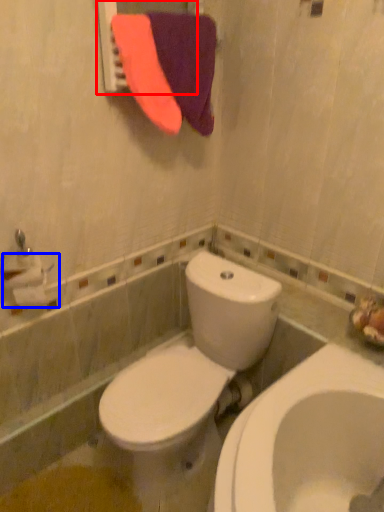
Question: Which of the following is the closest to the observer, mirror (highlighted by a red box) or toilet paper (highlighted by a blue box)?

Choices:
 (A) mirror
 (B) toilet paper

Answer: (A)